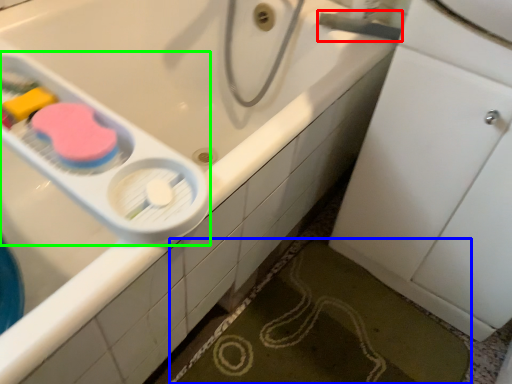
Question: Estimate the real-world distances between objects in this image. Which object is closer to plumbing fixture (highlighted by a red box), bath mat (highlighted by a blue box) or scale (highlighted by a green box)?

Choices:
 (A) bath mat
 (B) scale

Answer: (B)